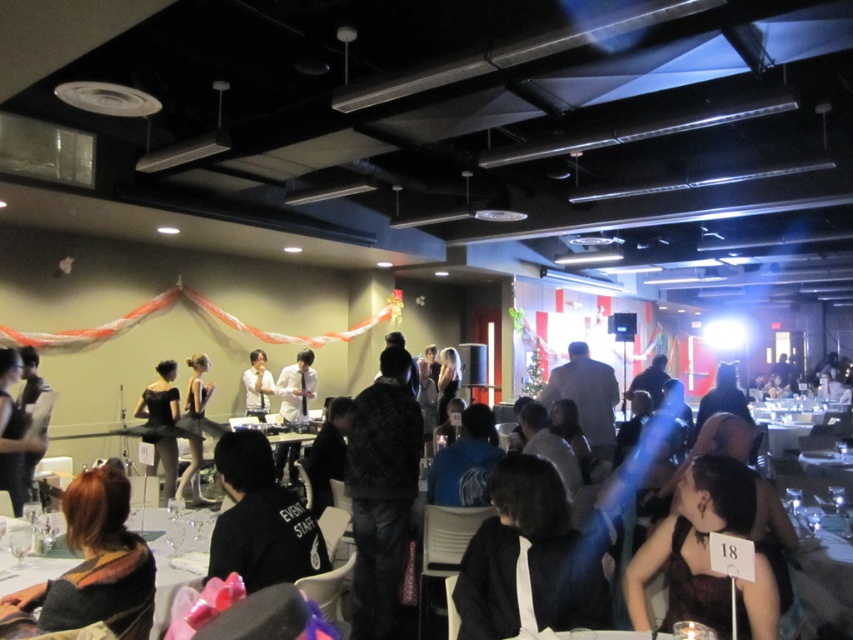
You are at the entrance of the event venue and want to locate the black satin dress at lower right. According to the coordinates provided, in which direction should you move from your current position to reach it?

The black satin dress at lower right is located at coordinates point (x=694, y=545). Since you are at the entrance, you should move towards the lower right direction to reach it.

You are standing at the entrance of the event venue and see the point marked at coordinates (381, 490). What is the object located at this point?

The point at coordinates (381, 490) indicates the plaid shirt at center.